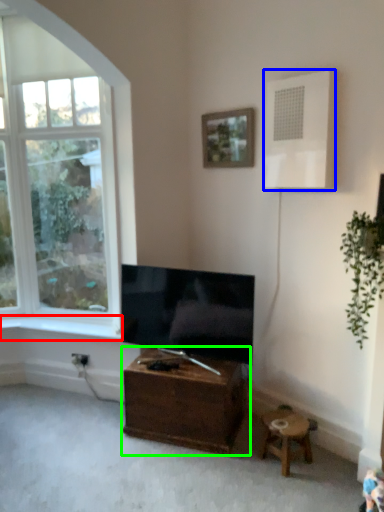
Question: Considering the real-world distances, which object is closest to window sill (highlighted by a red box)? air conditioner (highlighted by a blue box) or table (highlighted by a green box).

Choices:
 (A) air conditioner
 (B) table

Answer: (B)